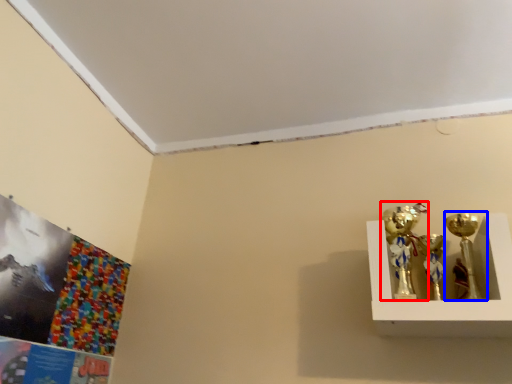
Question: Which object is closer to the camera taking this photo, candle holder (highlighted by a red box) or candle holder (highlighted by a blue box)?

Choices:
 (A) candle holder
 (B) candle holder

Answer: (B)